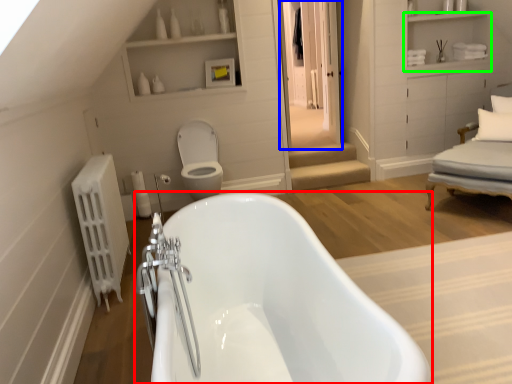
Question: Which object is positioned closest to bathtub (highlighted by a red box)? Select from glass door (highlighted by a blue box) and cabinet (highlighted by a green box).

Choices:
 (A) glass door
 (B) cabinet

Answer: (A)